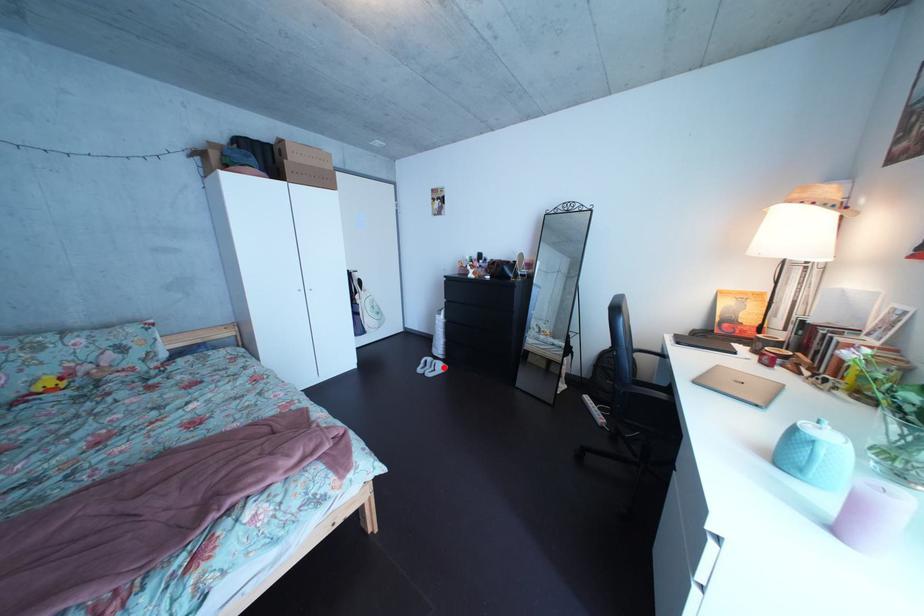
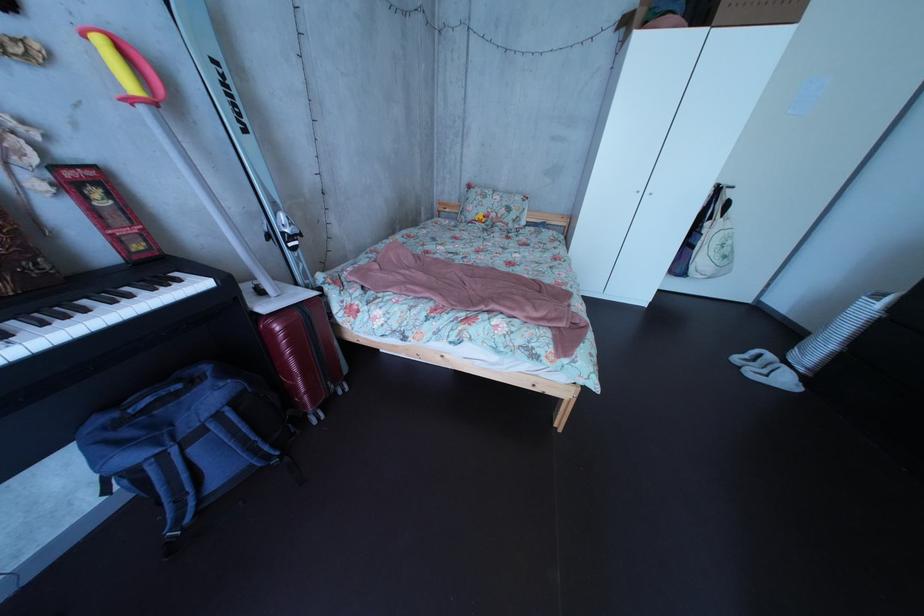
The point at the highlighted location is marked in the first image. Where is the corresponding point in the second image?

(784, 363)